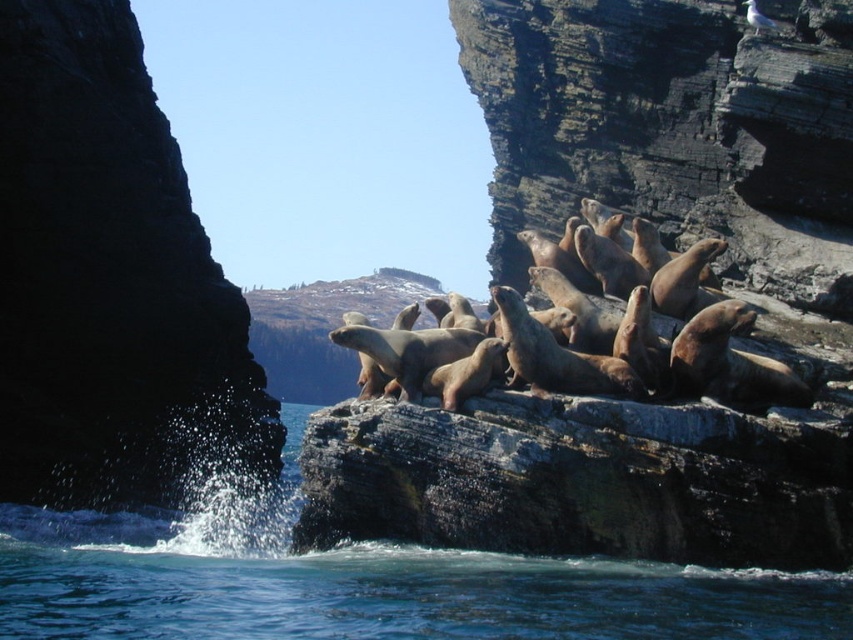
Who is positioned more to the right, smooth gray rock at center or blue liquid water at lower center?

From the viewer's perspective, smooth gray rock at center appears more on the right side.

Find the location of a particular element. smooth gray rock at center is located at coordinates (579, 481).

This screenshot has height=640, width=853. Identify the location of smooth gray rock at center. (579, 481).

Is dark rock cliff at left in front of blue liquid water at lower center?

No, it is not.

Measure the distance between dark rock cliff at left and camera.

56.95 meters

Image resolution: width=853 pixels, height=640 pixels. Identify the location of dark rock cliff at left. point(109,282).

Does point (833, 572) come in front of point (782, 493)?

No, (833, 572) is behind (782, 493).

Between clear blue water at lower center and smooth gray rock at center, which one is positioned higher?

Positioned higher is smooth gray rock at center.

Between point (833, 634) and point (624, 436), which one is positioned in front?

Point (833, 634) is in front.

At what (x,y) coordinates should I click in order to perform the action: click on clear blue water at lower center. Please return your answer as a coordinate pair (x, y). The height and width of the screenshot is (640, 853). Looking at the image, I should click on (366, 582).